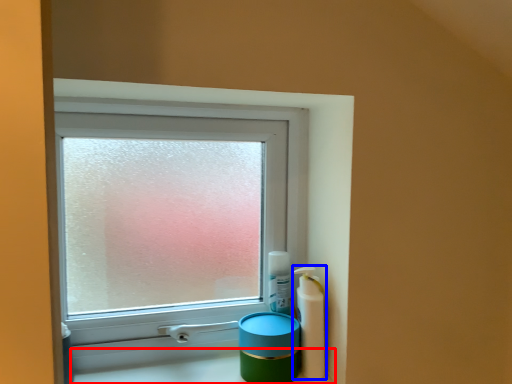
Question: Which of the following is the closest to the observer, counter top (highlighted by a red box) or mouthwash (highlighted by a blue box)?

Choices:
 (A) counter top
 (B) mouthwash

Answer: (A)